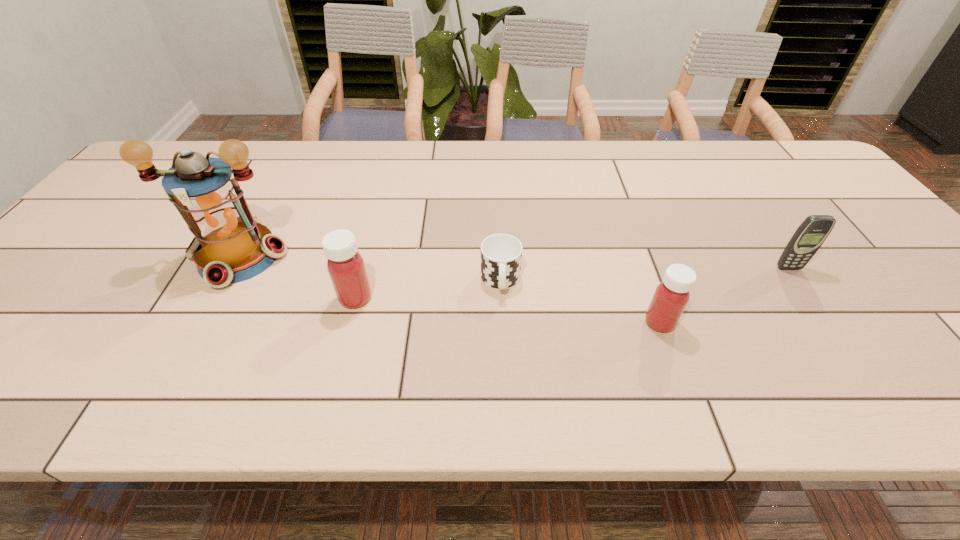
At what (x,y) coordinates should I click in order to perform the action: click on free space that is in between the cup and the shorter medicine. Please return your answer as a coordinate pair (x, y). The width and height of the screenshot is (960, 540). Looking at the image, I should click on (580, 302).

Find the location of a particular element. This screenshot has width=960, height=540. vacant space that's between the right medicine and the second object from left to right is located at coordinates (508, 310).

Identify the location of vacant area that lies between the fourth object from right to left and the right medicine. (508, 310).

The image size is (960, 540). Identify the location of vacant space that is in between the right medicine and the left medicine. (508, 310).

Find the location of a particular element. This screenshot has width=960, height=540. free space between the cup and the leftmost object is located at coordinates (370, 268).

Identify which object is the second closest to the cellular telephone. Please provide its 2D coordinates. Your answer should be formatted as a tuple, i.e. [(x, y)], where the tuple contains the x and y coordinates of a point satisfying the conditions above.

[(501, 254)]

The height and width of the screenshot is (540, 960). I want to click on object identified as the closest to the fourth object from left to right, so click(501, 254).

This screenshot has height=540, width=960. Find the location of `the closest medicine relative to the leftmost object`. the closest medicine relative to the leftmost object is located at coordinates (345, 265).

Identify the location of medicine that stands as the second closest to the cup. click(671, 296).

The image size is (960, 540). In order to click on free location that satisfies the following two spatial constraints: 1. on the side of the shortest object with the handle; 2. on the left side of the shorter medicine in this screenshot , I will do click(502, 322).